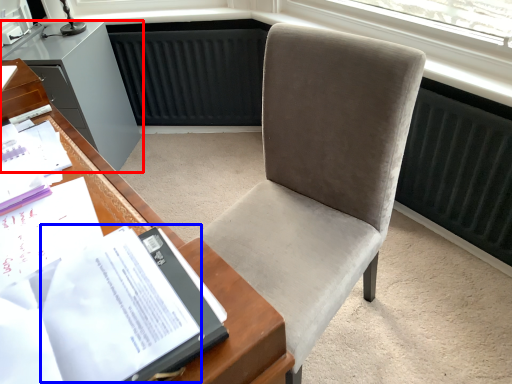
Question: Which object is further to the camera taking this photo, cabinetry (highlighted by a red box) or journal (highlighted by a blue box)?

Choices:
 (A) cabinetry
 (B) journal

Answer: (A)